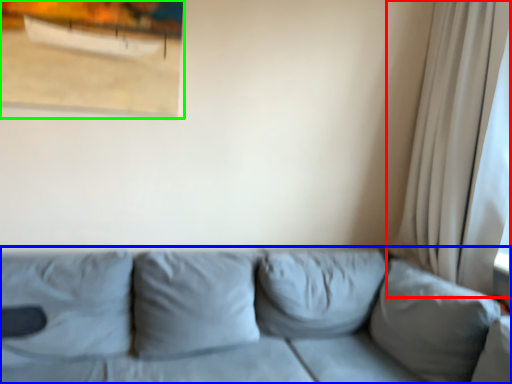
Question: Which object is the farthest from curtain (highlighted by a red box)? Choose among these: studio couch (highlighted by a blue box) or picture frame (highlighted by a green box).

Choices:
 (A) studio couch
 (B) picture frame

Answer: (B)